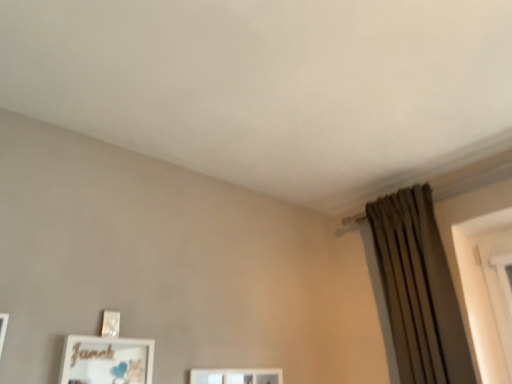
Question: Is matte gold picture frame at lower left closer to the viewer compared to brown textured curtain at right?

Choices:
 (A) yes
 (B) no

Answer: (A)

Question: Does matte gold picture frame at lower left have a larger size compared to brown textured curtain at right?

Choices:
 (A) no
 (B) yes

Answer: (A)

Question: Is matte gold picture frame at lower left aimed at brown textured curtain at right?

Choices:
 (A) no
 (B) yes

Answer: (A)

Question: Is matte gold picture frame at lower left not close to brown textured curtain at right?

Choices:
 (A) no
 (B) yes

Answer: (B)

Question: Is matte gold picture frame at lower left located outside brown textured curtain at right?

Choices:
 (A) yes
 (B) no

Answer: (A)

Question: Considering the relative positions of matte gold picture frame at lower left and brown textured curtain at right in the image provided, is matte gold picture frame at lower left to the left of brown textured curtain at right from the viewer's perspective?

Choices:
 (A) yes
 (B) no

Answer: (A)

Question: Considering the relative sizes of brown textured curtain at right and matte gold picture frame at lower left in the image provided, is brown textured curtain at right bigger than matte gold picture frame at lower left?

Choices:
 (A) yes
 (B) no

Answer: (A)

Question: Is the surface of brown textured curtain at right in direct contact with matte gold picture frame at lower left?

Choices:
 (A) no
 (B) yes

Answer: (A)

Question: Is brown textured curtain at right outside of matte gold picture frame at lower left?

Choices:
 (A) no
 (B) yes

Answer: (B)

Question: From the image's perspective, is brown textured curtain at right beneath matte gold picture frame at lower left?

Choices:
 (A) no
 (B) yes

Answer: (A)

Question: Can matte gold picture frame at lower left be found inside brown textured curtain at right?

Choices:
 (A) yes
 (B) no

Answer: (B)

Question: From a real-world perspective, is brown textured curtain at right on matte gold picture frame at lower left?

Choices:
 (A) yes
 (B) no

Answer: (A)

Question: Based on their sizes in the image, would you say matte gold picture frame at lower left is bigger or smaller than brown textured curtain at right?

Choices:
 (A) big
 (B) small

Answer: (B)